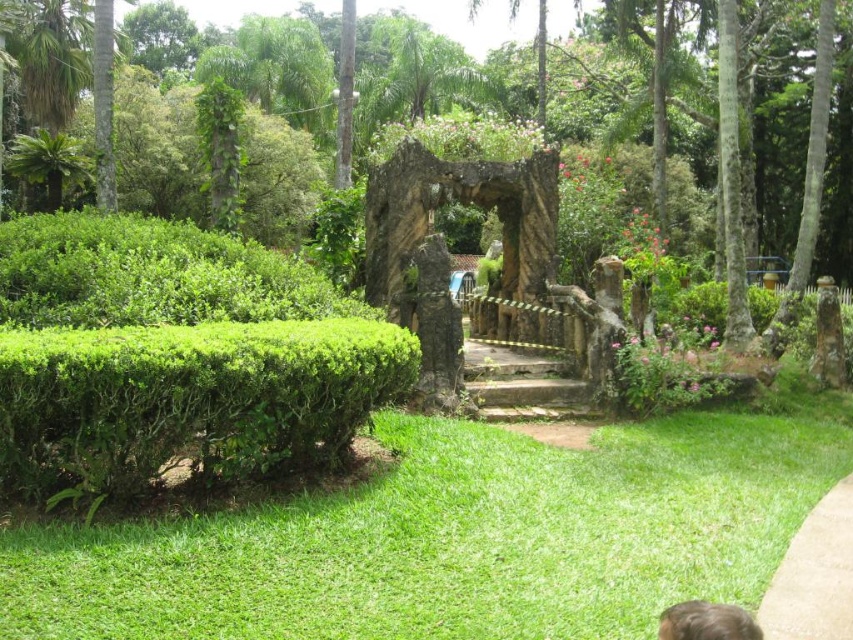
Is brown stone stairs at center wider than brown hair at lower right?

Yes, brown stone stairs at center is wider than brown hair at lower right.

Does brown stone stairs at center come behind brown hair at lower right?

Yes, it is behind brown hair at lower right.

Is point (572, 406) farther from camera compared to point (746, 614)?

Yes, it is behind point (746, 614).

Where is `brown stone stairs at center`? The image size is (853, 640). brown stone stairs at center is located at coordinates (529, 394).

Is green leafy hedge at left positioned at the back of brown stone stairs at center?

No, green leafy hedge at left is in front of brown stone stairs at center.

Is green leafy hedge at left thinner than brown stone stairs at center?

Incorrect, green leafy hedge at left's width is not less than brown stone stairs at center's.

Who is more distant from viewer, (54, 301) or (465, 369)?

The point (465, 369) is more distant.

Identify the location of green leafy hedge at left. (173, 356).

Between point (33, 547) and point (701, 612), which one is positioned in front?

Point (701, 612) is more forward.

Does green grass at lower center appear on the right side of brown hair at lower right?

Yes, green grass at lower center is to the right of brown hair at lower right.

Locate an element on the screen. Image resolution: width=853 pixels, height=640 pixels. green grass at lower center is located at coordinates (451, 540).

Locate an element on the screen. This screenshot has height=640, width=853. green grass at lower center is located at coordinates (451, 540).